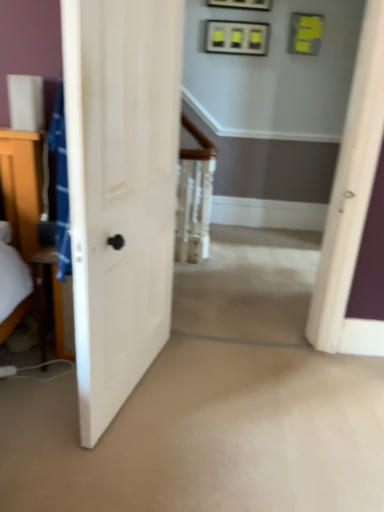
This screenshot has height=512, width=384. What are the coordinates of `matte black picture frame at upper center` in the screenshot? It's located at (242, 4).

What do you see at coordinates (242, 4) in the screenshot?
I see `matte black picture frame at upper center` at bounding box center [242, 4].

Find the location of `matte black picture frame at upper center`. matte black picture frame at upper center is located at coordinates (242, 4).